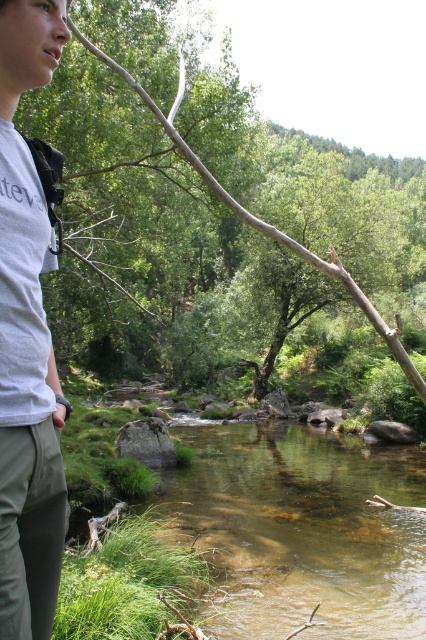
Can you confirm if clear water at center is positioned to the left of white cotton shirt at left?

Incorrect, clear water at center is not on the left side of white cotton shirt at left.

How much distance is there between clear water at center and white cotton shirt at left?

They are 7.27 meters apart.

Does point (402, 490) come behind point (40, 403)?

That is True.

Locate an element on the screen. Image resolution: width=426 pixels, height=640 pixels. clear water at center is located at coordinates (301, 531).

This screenshot has width=426, height=640. What do you see at coordinates (301, 531) in the screenshot?
I see `clear water at center` at bounding box center [301, 531].

Is clear water at center closer to the viewer compared to gray rough rock at center?

That is True.

Describe the element at coordinates (301, 531) in the screenshot. The height and width of the screenshot is (640, 426). I see `clear water at center` at that location.

Locate an element on the screen. The height and width of the screenshot is (640, 426). clear water at center is located at coordinates (301, 531).

Does clear water at center appear over smooth brown branch at upper center?

Actually, clear water at center is below smooth brown branch at upper center.

In order to click on clear water at center in this screenshot , I will do `click(301, 531)`.